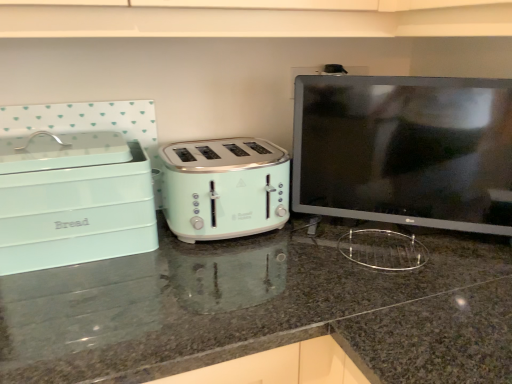
Where is `free space above mint green plastic bread bin at left (from a real-world perspective)`? free space above mint green plastic bread bin at left (from a real-world perspective) is located at coordinates (49, 149).